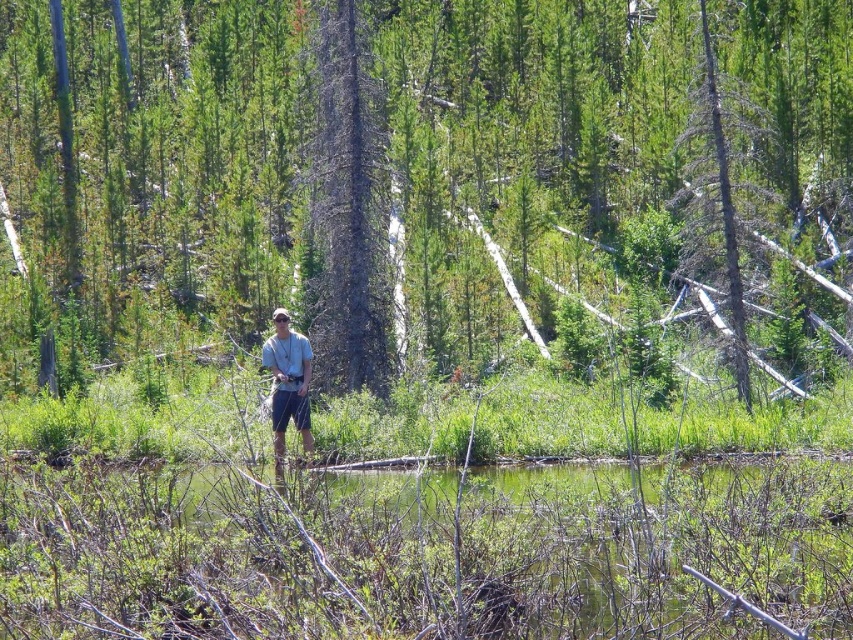
You are a hiker who needs to cross the forest. You have a 1.2 meter wide backpack. Can you carry both the green liquid water at center and the dark gray bark tree at center together without exceeding the backpack width?

The green liquid water at center is narrower than the dark gray bark tree at center. However, since the exact widths are not provided, it is impossible to determine if their combined width would exceed the backpack capacity.

You are a hiker who wants to cross the small body of water in the forest. There is a point marked at coordinates [426,554]. What is located at that point?

The point at coordinates [426,554] corresponds to green liquid water at center, so the hiker should be cautious as the area is water and not solid ground.

You are a hiker in the forest and want to take a photo of the dead wood tree at upper right without the green liquid water at center appearing in the foreground. Is this possible?

The green liquid water at center is closer to the viewer than the dead wood tree at upper right, so it would block the view of the dead wood tree at upper right. Therefore, it is not possible to take a photo of the dead wood tree at upper right without the green liquid water at center appearing in the foreground.